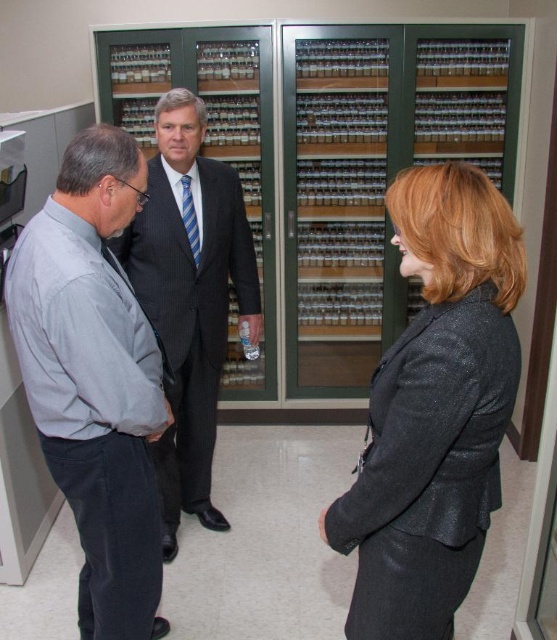
Between point (385, 500) and point (190, 435), which one is positioned in front?

Point (385, 500) is more forward.

Between sparkly black blazer at center and dark gray pinstripe suit at center, which one is positioned higher?

Positioned higher is dark gray pinstripe suit at center.

You are a GUI agent. You are given a task and a screenshot of the screen. Output one action in this format:
    pyautogui.click(x=<x>, y=<y>)
    Task: Click on the sparkly black blazer at center
    
    Given the screenshot: What is the action you would take?
    pyautogui.click(x=434, y=410)

Locate an element on the screen. This screenshot has height=640, width=557. sparkly black blazer at center is located at coordinates (434, 410).

In order to click on gray shirt at left in this screenshot , I will do `click(95, 378)`.

Which is below, sparkly black blazer at center or gray shirt at left?

Positioned lower is gray shirt at left.

Who is more distant from viewer, (x=465, y=548) or (x=46, y=403)?

Positioned behind is point (x=46, y=403).

Where is `sparkly black blazer at center`? sparkly black blazer at center is located at coordinates (434, 410).